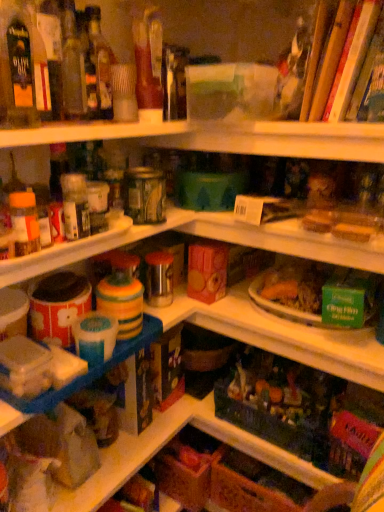
Question: Is translucent glass bottle at upper left, positioned as the first bottle in back-to-front order, not within wooden sticks at upper right?

Choices:
 (A) yes
 (B) no

Answer: (A)

Question: Considering the relative sizes of translucent glass bottle at upper left, positioned as the first bottle in back-to-front order, and wooden sticks at upper right in the image provided, is translucent glass bottle at upper left, positioned as the first bottle in back-to-front order, thinner than wooden sticks at upper right?

Choices:
 (A) no
 (B) yes

Answer: (B)

Question: Is translucent glass bottle at upper left, placed as the 1th bottle when sorted from right to left, further to camera compared to wooden sticks at upper right?

Choices:
 (A) yes
 (B) no

Answer: (A)

Question: Does translucent glass bottle at upper left, which ranks as the second bottle in front-to-back order, have a larger size compared to wooden sticks at upper right?

Choices:
 (A) yes
 (B) no

Answer: (B)

Question: From the image's perspective, is translucent glass bottle at upper left, placed as the 1th bottle when sorted from right to left, located beneath wooden sticks at upper right?

Choices:
 (A) yes
 (B) no

Answer: (A)

Question: Does translucent glass bottle at upper left, placed as the 1th bottle when sorted from right to left, turn towards wooden sticks at upper right?

Choices:
 (A) no
 (B) yes

Answer: (A)

Question: Could you tell me if matte glass bottle at upper left, which is the 1th bottle from front to back, is facing translucent glass bottle at upper left, placed as the 1th bottle when sorted from right to left?

Choices:
 (A) yes
 (B) no

Answer: (B)

Question: Is matte glass bottle at upper left, marked as the second bottle in a back-to-front arrangement, at the left side of translucent glass bottle at upper left, positioned as the first bottle in back-to-front order?

Choices:
 (A) no
 (B) yes

Answer: (B)

Question: From the image's perspective, is matte glass bottle at upper left, marked as the second bottle in a back-to-front arrangement, under translucent glass bottle at upper left, placed as the 1th bottle when sorted from right to left?

Choices:
 (A) yes
 (B) no

Answer: (A)

Question: Is matte glass bottle at upper left, which is the 1th bottle from front to back, positioned in front of translucent glass bottle at upper left, which ranks as the second bottle in front-to-back order?

Choices:
 (A) no
 (B) yes

Answer: (B)

Question: Is matte glass bottle at upper left, which is the 1th bottle from front to back, positioned beyond the bounds of translucent glass bottle at upper left, which ranks as the second bottle in front-to-back order?

Choices:
 (A) yes
 (B) no

Answer: (A)

Question: From a real-world perspective, is matte glass bottle at upper left, which is the 1th bottle from front to back, located beneath translucent glass bottle at upper left, the 2th bottle in the left-to-right sequence?

Choices:
 (A) yes
 (B) no

Answer: (B)

Question: Is wooden sticks at upper right positioned with its back to translucent glass bottle at upper left, the 2th bottle in the left-to-right sequence?

Choices:
 (A) no
 (B) yes

Answer: (A)